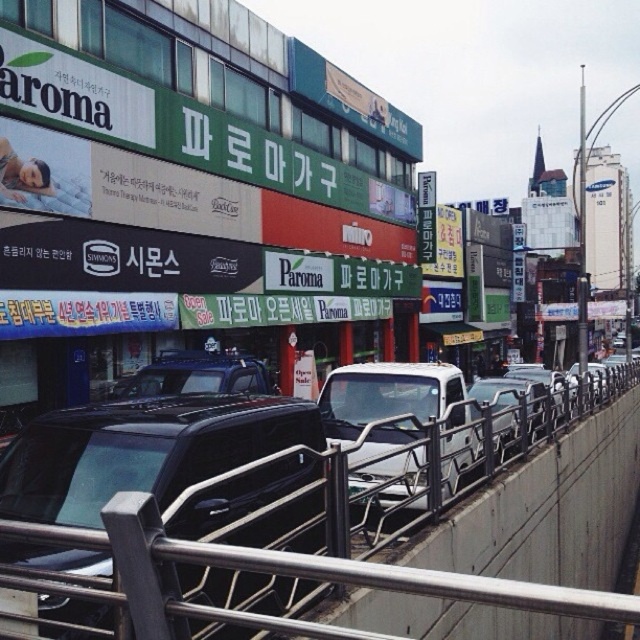
You are a delivery person trying to navigate through the street. You see the metallic gray rail at center and the black matte car at center. Which object is nearer to you as you stand on the sidewalk?

The metallic gray rail at center is closer to the viewer than the black matte car at center, so the metallic gray rail at center is nearer to you.

You are a delivery person standing at the edge of the elevated walkway in the scene. You need to place a package on the metallic gray rail at center. Can you safely reach the rail without stepping over the edge?

The metallic gray rail at center is 1.96 meters away from viewer. Since the rail is within a safe reaching distance, you can safely place the package on it without needing to step over the edge.